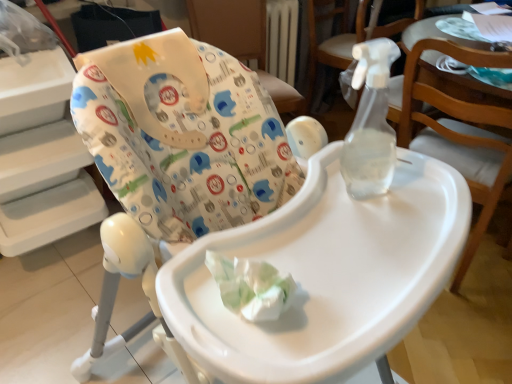
Question: Should I look upward or downward to see transparent plastic spray bottle at upper right, the second chair positioned from the front?

Choices:
 (A) up
 (B) down

Answer: (A)

Question: Is white fabric highchair at upper center, the 4th chair in the front-to-back sequence, at the back of transparent plastic spray bottle at upper right, the 2th chair positioned from the back?

Choices:
 (A) no
 (B) yes

Answer: (A)

Question: Is transparent plastic spray bottle at upper right, the third chair from the front, next to white fabric highchair at upper center, the 4th chair in the front-to-back sequence?

Choices:
 (A) yes
 (B) no

Answer: (B)

Question: Is transparent plastic spray bottle at upper right, the 2th chair positioned from the back, outside white fabric highchair at upper center, the 4th chair in the front-to-back sequence?

Choices:
 (A) no
 (B) yes

Answer: (B)

Question: From a real-world perspective, is transparent plastic spray bottle at upper right, the 2th chair positioned from the back, physically above white fabric highchair at upper center, the 4th chair in the front-to-back sequence?

Choices:
 (A) yes
 (B) no

Answer: (B)

Question: Is transparent plastic spray bottle at upper right, the third chair from the front, positioned behind white fabric highchair at upper center, which is counted as the 1th chair, starting from the back?

Choices:
 (A) no
 (B) yes

Answer: (A)

Question: Is white fabric highchair at upper center, the 4th chair in the front-to-back sequence, a part of transparent plastic spray bottle at upper right, the 2th chair positioned from the back?

Choices:
 (A) yes
 (B) no

Answer: (B)

Question: Is white plastic highchair at center, the first chair when ordered from front to back, thinner than white fabric highchair at upper center, which is counted as the 1th chair, starting from the back?

Choices:
 (A) yes
 (B) no

Answer: (B)

Question: Is white fabric highchair at upper center, the 4th chair in the front-to-back sequence, located within white plastic highchair at center, the first chair when ordered from front to back?

Choices:
 (A) no
 (B) yes

Answer: (A)

Question: From the image's perspective, is white plastic highchair at center, the 4th chair positioned from the back, under white fabric highchair at upper center, the 4th chair in the front-to-back sequence?

Choices:
 (A) yes
 (B) no

Answer: (A)

Question: From a real-world perspective, is white plastic highchair at center, the 4th chair positioned from the back, on top of white fabric highchair at upper center, which is counted as the 1th chair, starting from the back?

Choices:
 (A) no
 (B) yes

Answer: (B)

Question: Is white plastic highchair at center, the first chair when ordered from front to back, to the right of white fabric highchair at upper center, which is counted as the 1th chair, starting from the back, from the viewer's perspective?

Choices:
 (A) no
 (B) yes

Answer: (A)

Question: Does white plastic highchair at center, the first chair when ordered from front to back, lie in front of white fabric highchair at upper center, the 4th chair in the front-to-back sequence?

Choices:
 (A) yes
 (B) no

Answer: (A)

Question: From a real-world perspective, is transparent plastic spray bottle at upper right, the 2th chair positioned from the back, on top of transparent plastic spray bottle at upper right, the third chair positioned from the back?

Choices:
 (A) no
 (B) yes

Answer: (A)